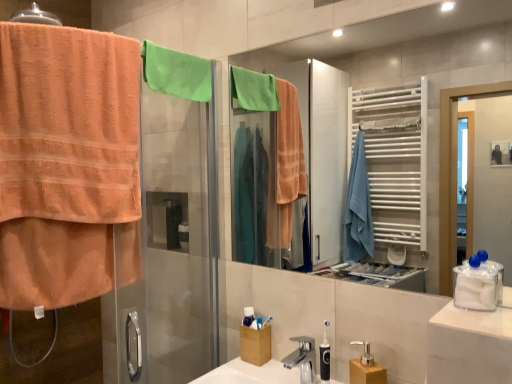
The height and width of the screenshot is (384, 512). What do you see at coordinates (67, 164) in the screenshot?
I see `orange terry cloth towel at left` at bounding box center [67, 164].

How much space does white plastic toothbrush at center, arranged as the first toiletry when viewed from the left, occupy vertically?

The height of white plastic toothbrush at center, arranged as the first toiletry when viewed from the left, is 1.90 inches.

Image resolution: width=512 pixels, height=384 pixels. In order to click on black plastic toothbrush at center, which ranks as the 2th toiletry in back-to-front order in this screenshot , I will do `click(325, 356)`.

Find the location of `green cotton towel at upper center`. green cotton towel at upper center is located at coordinates (176, 73).

The image size is (512, 384). What are the coordinates of `matte glass mirror at center` in the screenshot? It's located at (396, 61).

Is black plastic toothbrush at center, the first toiletry from the right, looking in the opposite direction of matte glass mirror at center?

No.

From the image's perspective, which is below, black plastic toothbrush at center, the 1th toiletry positioned from the front, or matte glass mirror at center?

black plastic toothbrush at center, the 1th toiletry positioned from the front, from the image's perspective.

Considering the sizes of black plastic toothbrush at center, the 1th toiletry positioned from the front, and matte glass mirror at center in the image, is black plastic toothbrush at center, the 1th toiletry positioned from the front, wider or thinner than matte glass mirror at center?

In the image, black plastic toothbrush at center, the 1th toiletry positioned from the front, appears to be wider than matte glass mirror at center.

Between point (325, 334) and point (510, 29), which one is positioned behind?

The point (510, 29) is farther from the camera.

From a real-world perspective, between green cotton towel at upper center and matte glass mirror at center, who is vertically higher?

green cotton towel at upper center.

Is green cotton towel at upper center taller or shorter than matte glass mirror at center?

Considering their sizes, green cotton towel at upper center has less height than matte glass mirror at center.

Is green cotton towel at upper center wider or thinner than matte glass mirror at center?

In the image, green cotton towel at upper center appears to be wider than matte glass mirror at center.

Can you confirm if green cotton towel at upper center is bigger than matte glass mirror at center?

No, green cotton towel at upper center is not bigger than matte glass mirror at center.

How different are the orientations of white plastic toothbrush at center, the second toiletry positioned from the right, and black plastic toothbrush at center, marked as the 2th toiletry in a left-to-right arrangement, in degrees?

37.9 degrees separate the facing orientations of white plastic toothbrush at center, the second toiletry positioned from the right, and black plastic toothbrush at center, marked as the 2th toiletry in a left-to-right arrangement.

Who is bigger, white plastic toothbrush at center, arranged as the first toiletry when viewed from the left, or black plastic toothbrush at center, the 1th toiletry positioned from the front?

Bigger between the two is black plastic toothbrush at center, the 1th toiletry positioned from the front.

Is white plastic toothbrush at center, the second toiletry positioned from the right, far from black plastic toothbrush at center, the first toiletry from the right?

That's not correct — white plastic toothbrush at center, the second toiletry positioned from the right, is a little close to black plastic toothbrush at center, the first toiletry from the right.

Based on the photo, relative to black plastic toothbrush at center, the first toiletry from the right, is white plastic toothbrush at center, arranged as the first toiletry when viewed from the left, in front or behind?

Clearly, white plastic toothbrush at center, arranged as the first toiletry when viewed from the left, is behind black plastic toothbrush at center, the first toiletry from the right.

From the image's perspective, is black plastic toothbrush at center, which ranks as the 2th toiletry in back-to-front order, below white plastic toothbrush at center, which is the 2th toiletry in front-to-back order?

Yes.

Can you tell me how much black plastic toothbrush at center, which ranks as the 2th toiletry in back-to-front order, and white plastic toothbrush at center, arranged as the first toiletry when viewed from the left, differ in facing direction?

black plastic toothbrush at center, which ranks as the 2th toiletry in back-to-front order, and white plastic toothbrush at center, arranged as the first toiletry when viewed from the left, are facing 37.9 degrees away from each other.

Considering the points (325, 359) and (261, 327), which point is in front, point (325, 359) or point (261, 327)?

Point (325, 359)

In terms of width, does black plastic toothbrush at center, the 1th toiletry positioned from the front, look wider or thinner when compared to white plastic toothbrush at center, positioned as the 1th toiletry in back-to-front order?

Considering their sizes, black plastic toothbrush at center, the 1th toiletry positioned from the front, looks broader than white plastic toothbrush at center, positioned as the 1th toiletry in back-to-front order.

Which object is closer to the camera, white plastic toothbrush at center, positioned as the 1th toiletry in back-to-front order, or green cotton towel at upper center?

Positioned in front is green cotton towel at upper center.

Which is behind, point (260, 321) or point (190, 61)?

The point (190, 61) is behind.

Can you confirm if white plastic toothbrush at center, positioned as the 1th toiletry in back-to-front order, is smaller than green cotton towel at upper center?

Yes, white plastic toothbrush at center, positioned as the 1th toiletry in back-to-front order, is smaller than green cotton towel at upper center.

Considering the positions of objects matte glass mirror at center and white plastic toothbrush at center, arranged as the first toiletry when viewed from the left, in the image provided, who is in front, matte glass mirror at center or white plastic toothbrush at center, arranged as the first toiletry when viewed from the left,?

matte glass mirror at center is more forward.

Consider the image. Can white plastic toothbrush at center, which is the 2th toiletry in front-to-back order, be found inside matte glass mirror at center?

Actually, white plastic toothbrush at center, which is the 2th toiletry in front-to-back order, is outside matte glass mirror at center.

Is matte glass mirror at center at the right side of white plastic toothbrush at center, which is the 2th toiletry in front-to-back order?

Yes.

Could you tell me if matte glass mirror at center is turned towards white plastic toothbrush at center, arranged as the first toiletry when viewed from the left?

No, matte glass mirror at center is not oriented towards white plastic toothbrush at center, arranged as the first toiletry when viewed from the left.

Which is more to the right, green cotton towel at upper center or black plastic toothbrush at center, the first toiletry from the right?

black plastic toothbrush at center, the first toiletry from the right, is more to the right.

Which object is more forward, green cotton towel at upper center or black plastic toothbrush at center, the 1th toiletry positioned from the front?

black plastic toothbrush at center, the 1th toiletry positioned from the front.

The width and height of the screenshot is (512, 384). Find the location of `toiletry located in front of the green cotton towel at upper center`. toiletry located in front of the green cotton towel at upper center is located at coordinates (325, 356).

Considering the relative sizes of green cotton towel at upper center and black plastic toothbrush at center, the 1th toiletry positioned from the front, in the image provided, is green cotton towel at upper center shorter than black plastic toothbrush at center, the 1th toiletry positioned from the front,?

Correct, green cotton towel at upper center is not as tall as black plastic toothbrush at center, the 1th toiletry positioned from the front.

The image size is (512, 384). What are the coordinates of `the 2nd toiletry below the matte glass mirror at center (from the image's perspective)` in the screenshot? It's located at (325, 356).

You are a GUI agent. You are given a task and a screenshot of the screen. Output one action in this format:
    pyautogui.click(x=<x>, y=<y>)
    Task: Click on the mirror located on the right of green cotton towel at upper center
    
    Given the screenshot: What is the action you would take?
    pyautogui.click(x=396, y=61)

Which object lies further to the anchor point matte glass mirror at center, black plastic toothbrush at center, marked as the 2th toiletry in a left-to-right arrangement, or white plastic toothbrush at center, which is the 2th toiletry in front-to-back order?

Among the two, white plastic toothbrush at center, which is the 2th toiletry in front-to-back order, is located further to matte glass mirror at center.

Which object lies further to the anchor point matte glass mirror at center, white plastic toothbrush at center, positioned as the 1th toiletry in back-to-front order, or orange terry cloth towel at left?

The object further to matte glass mirror at center is white plastic toothbrush at center, positioned as the 1th toiletry in back-to-front order.

Based on their spatial positions, is white plastic toothbrush at center, which is the 2th toiletry in front-to-back order, or green cotton towel at upper center closer to black plastic toothbrush at center, the 1th toiletry positioned from the front?

white plastic toothbrush at center, which is the 2th toiletry in front-to-back order, is closer to black plastic toothbrush at center, the 1th toiletry positioned from the front.

Looking at the image, which one is located closer to green cotton towel at upper center, white plastic toothbrush at center, positioned as the 1th toiletry in back-to-front order, or black plastic toothbrush at center, the first toiletry from the right?

white plastic toothbrush at center, positioned as the 1th toiletry in back-to-front order, is closer to green cotton towel at upper center.

Based on their spatial positions, is green cotton towel at upper center or matte glass mirror at center further from orange terry cloth towel at left?

Among the two, matte glass mirror at center is located further to orange terry cloth towel at left.

When comparing their distances from white plastic toothbrush at center, arranged as the first toiletry when viewed from the left, does black plastic toothbrush at center, which ranks as the 2th toiletry in back-to-front order, or matte glass mirror at center seem closer?

Among the two, black plastic toothbrush at center, which ranks as the 2th toiletry in back-to-front order, is located nearer to white plastic toothbrush at center, arranged as the first toiletry when viewed from the left.

Considering their positions, is black plastic toothbrush at center, the 1th toiletry positioned from the front, positioned closer to white plastic toothbrush at center, positioned as the 1th toiletry in back-to-front order, than green cotton towel at upper center?

black plastic toothbrush at center, the 1th toiletry positioned from the front, is positioned closer to the anchor white plastic toothbrush at center, positioned as the 1th toiletry in back-to-front order.

When comparing their distances from black plastic toothbrush at center, which ranks as the 2th toiletry in back-to-front order, does green cotton towel at upper center or orange terry cloth towel at left seem further?

green cotton towel at upper center is positioned further to the anchor black plastic toothbrush at center, which ranks as the 2th toiletry in back-to-front order.

This screenshot has width=512, height=384. What are the coordinates of `toiletry between orange terry cloth towel at left and black plastic toothbrush at center, the first toiletry from the right, from left to right` in the screenshot? It's located at (259, 322).

The image size is (512, 384). I want to click on toiletry that lies between green cotton towel at upper center and black plastic toothbrush at center, marked as the 2th toiletry in a left-to-right arrangement, from top to bottom, so click(x=259, y=322).

Locate an element on the screen. The width and height of the screenshot is (512, 384). towel between green cotton towel at upper center and white plastic toothbrush at center, the second toiletry positioned from the right, in the up-down direction is located at coordinates (67, 164).

In order to click on towel between green cotton towel at upper center and black plastic toothbrush at center, marked as the 2th toiletry in a left-to-right arrangement, in the vertical direction in this screenshot , I will do `click(67, 164)`.